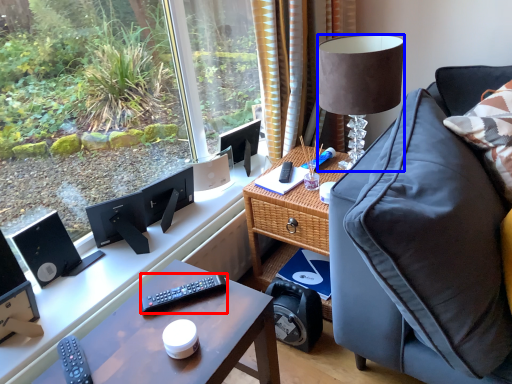
Question: Which object appears closest to the camera in this image, remote control (highlighted by a red box) or lamp (highlighted by a blue box)?

Choices:
 (A) remote control
 (B) lamp

Answer: (A)